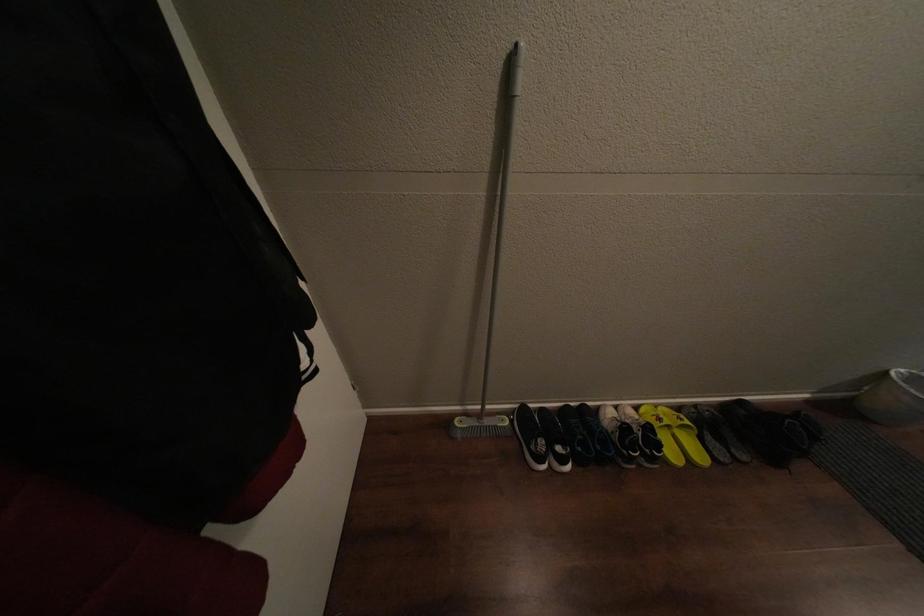
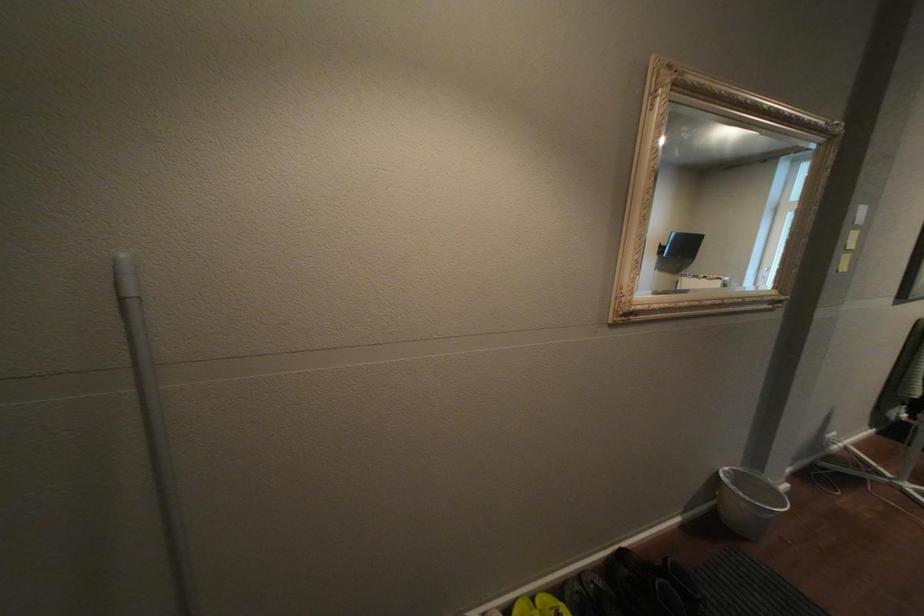
Based on the continuous images, in which direction is the camera rotating?

The camera rotated toward right-up.